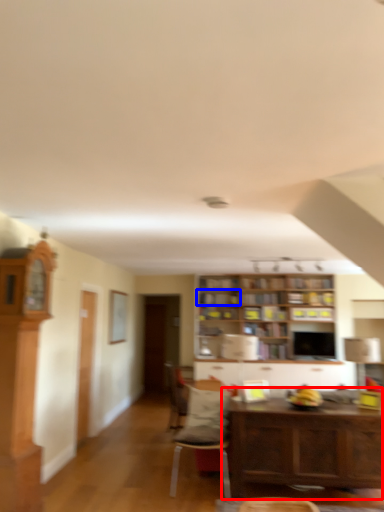
Question: Which object appears closest to the camera in this image, table (highlighted by a red box) or shelf (highlighted by a blue box)?

Choices:
 (A) table
 (B) shelf

Answer: (A)